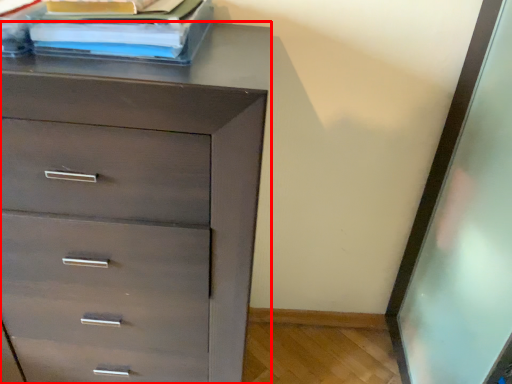
Question: Observing the image, what is the correct spatial positioning of chest of drawers (annotated by the red box) in reference to book?

Choices:
 (A) right
 (B) left

Answer: (B)